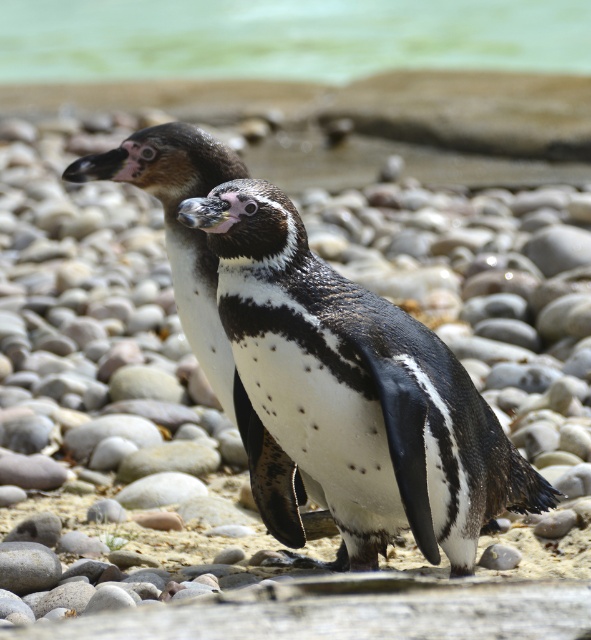
Can you confirm if black and white penguin at center is wider than green water at upper center?

No, black and white penguin at center is not wider than green water at upper center.

Which is behind, point (460, 467) or point (220, 33)?

The point (220, 33) is more distant.

Image resolution: width=591 pixels, height=640 pixels. I want to click on black and white penguin at center, so click(x=320, y=365).